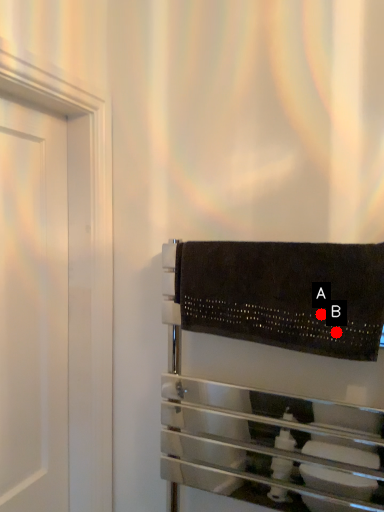
Question: Two points are circled on the image, labeled by A and B beside each circle. Which point is closer to the camera taking this photo?

Choices:
 (A) A is closer
 (B) B is closer

Answer: (B)